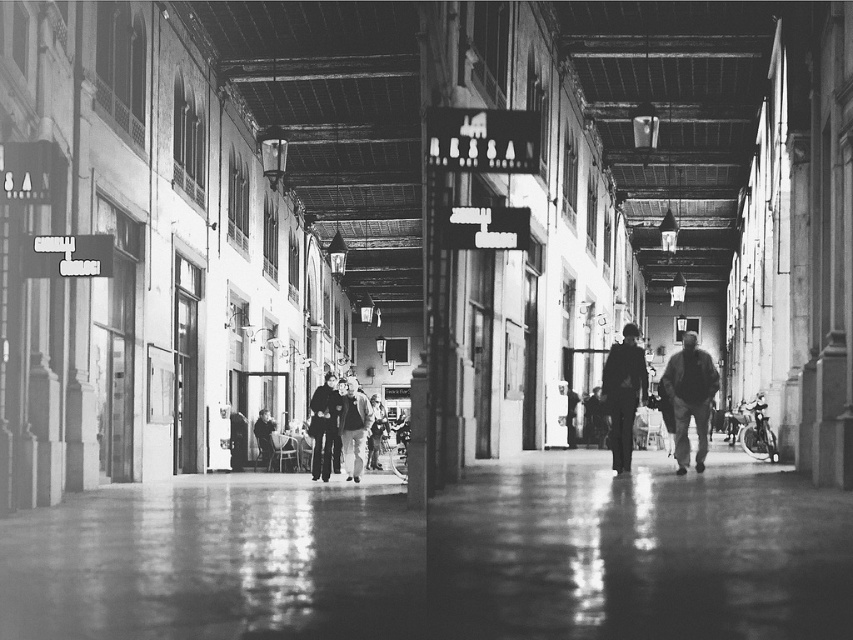
Is smooth leather jacket at center thinner than dark fabric coat at center?

Indeed, smooth leather jacket at center has a lesser width compared to dark fabric coat at center.

Does smooth leather jacket at center have a smaller size compared to dark fabric coat at center?

Indeed, smooth leather jacket at center has a smaller size compared to dark fabric coat at center.

This screenshot has height=640, width=853. What are the coordinates of `smooth leather jacket at center` in the screenshot? It's located at (689, 397).

At what (x,y) coordinates should I click in order to perform the action: click on dark fabric coat at center. Please return your answer as a coordinate pair (x, y). The height and width of the screenshot is (640, 853). Looking at the image, I should click on (624, 394).

This screenshot has height=640, width=853. Describe the element at coordinates (624, 394) in the screenshot. I see `dark fabric coat at center` at that location.

Identify the location of dark fabric coat at center. This screenshot has height=640, width=853. (624, 394).

Is smooth leather jacket at center bigger than dark blue jeans at center?

Actually, smooth leather jacket at center might be smaller than dark blue jeans at center.

Is smooth leather jacket at center wider than dark blue jeans at center?

No, smooth leather jacket at center is not wider than dark blue jeans at center.

Where is `smooth leather jacket at center`? The width and height of the screenshot is (853, 640). smooth leather jacket at center is located at coordinates (689, 397).

This screenshot has height=640, width=853. In order to click on smooth leather jacket at center in this screenshot , I will do `click(689, 397)`.